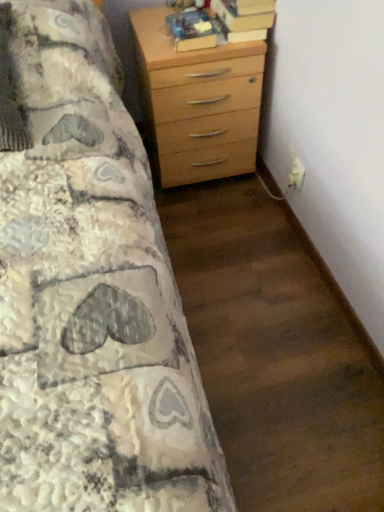
Question: Can you confirm if hardcover book at upper right, the 2th book positioned from the left, is positioned to the left of light wood chest of drawers at upper right?

Choices:
 (A) no
 (B) yes

Answer: (A)

Question: Considering the relative positions of hardcover book at upper right, the 2th book positioned from the left, and light wood chest of drawers at upper right in the image provided, is hardcover book at upper right, the 2th book positioned from the left, behind light wood chest of drawers at upper right?

Choices:
 (A) yes
 (B) no

Answer: (A)

Question: Is hardcover book at upper right, the 2th book positioned from the left, turned away from light wood chest of drawers at upper right?

Choices:
 (A) no
 (B) yes

Answer: (A)

Question: Does hardcover book at upper right, the 2th book positioned from the left, have a greater height compared to light wood chest of drawers at upper right?

Choices:
 (A) no
 (B) yes

Answer: (A)

Question: Does hardcover book at upper right, placed as the 1th book when sorted from right to left, have a smaller size compared to light wood chest of drawers at upper right?

Choices:
 (A) yes
 (B) no

Answer: (A)

Question: Does hardcover book at upper right, the 2th book positioned from the left, lie in front of light wood chest of drawers at upper right?

Choices:
 (A) yes
 (B) no

Answer: (B)

Question: Is light wood chest of drawers at upper right shorter than hardcover book at upper center, marked as the second book in a right-to-left arrangement?

Choices:
 (A) no
 (B) yes

Answer: (A)

Question: Does light wood chest of drawers at upper right lie in front of hardcover book at upper center, which ranks as the 1th book in left-to-right order?

Choices:
 (A) yes
 (B) no

Answer: (A)

Question: Does light wood chest of drawers at upper right lie behind hardcover book at upper center, marked as the second book in a right-to-left arrangement?

Choices:
 (A) yes
 (B) no

Answer: (B)

Question: Does light wood chest of drawers at upper right have a lesser width compared to hardcover book at upper center, marked as the second book in a right-to-left arrangement?

Choices:
 (A) yes
 (B) no

Answer: (B)

Question: Is hardcover book at upper center, which ranks as the 1th book in left-to-right order, surrounded by light wood chest of drawers at upper right?

Choices:
 (A) yes
 (B) no

Answer: (B)

Question: Is light wood chest of drawers at upper right in contact with hardcover book at upper center, which ranks as the 1th book in left-to-right order?

Choices:
 (A) no
 (B) yes

Answer: (A)

Question: Can you confirm if hardcover book at upper right, the 2th book positioned from the left, is wider than hardcover book at upper center, which ranks as the 1th book in left-to-right order?

Choices:
 (A) no
 (B) yes

Answer: (B)